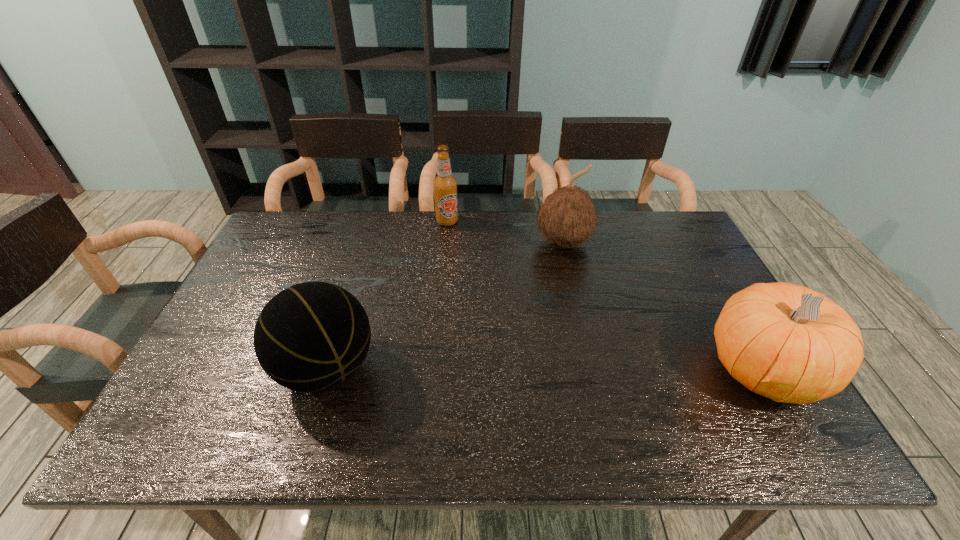
The width and height of the screenshot is (960, 540). I want to click on unoccupied position between the basketball and the beer bottle, so click(387, 295).

Locate an element on the screen. This screenshot has width=960, height=540. free space between the basketball and the third object from left to right is located at coordinates (445, 306).

At what (x,y) coordinates should I click in order to perform the action: click on object that ranks as the third closest to the beer bottle. Please return your answer as a coordinate pair (x, y). This screenshot has width=960, height=540. Looking at the image, I should click on (786, 342).

You are a GUI agent. You are given a task and a screenshot of the screen. Output one action in this format:
    pyautogui.click(x=<x>, y=<y>)
    Task: Click on the object that is the closest to the third object from right to left
    The width and height of the screenshot is (960, 540).
    Given the screenshot: What is the action you would take?
    pyautogui.click(x=567, y=217)

Locate an element on the screen. Image resolution: width=960 pixels, height=540 pixels. free space that satisfies the following two spatial constraints: 1. on the back side of the third object from left to right; 2. on the left side of the basketball is located at coordinates (367, 242).

At what (x,y) coordinates should I click in order to perform the action: click on vacant space that satisfies the following two spatial constraints: 1. on the front side of the rightmost object; 2. on the front-facing side of the leftmost object. Please return your answer as a coordinate pair (x, y). This screenshot has height=540, width=960. Looking at the image, I should click on (326, 370).

Identify the location of vacant area in the image that satisfies the following two spatial constraints: 1. on the front side of the basketball; 2. on the front-facing side of the pumpkin. The image size is (960, 540). (326, 370).

Locate an element on the screen. free spot that satisfies the following two spatial constraints: 1. on the front side of the rightmost object; 2. on the front-facing side of the second object from right to left is located at coordinates (593, 370).

What are the coordinates of `free region that satisfies the following two spatial constraints: 1. on the back side of the second object from left to right; 2. on the right side of the leftmost object` in the screenshot? It's located at click(373, 221).

I want to click on vacant area that satisfies the following two spatial constraints: 1. on the back side of the beer bottle; 2. on the right side of the leftmost object, so click(x=373, y=221).